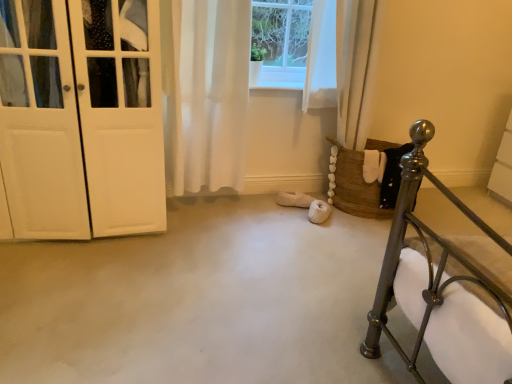
I want to click on vacant area that lies in front of white matte door at left, so click(81, 296).